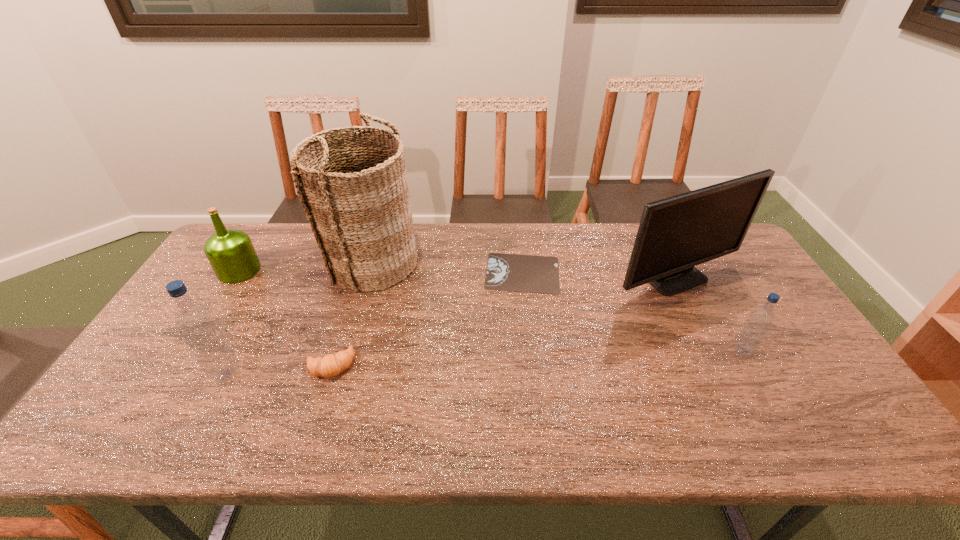
Where is `vacant area located on the front of the sixth object from right to left`? The height and width of the screenshot is (540, 960). vacant area located on the front of the sixth object from right to left is located at coordinates 210,405.

Find the location of a particular element. Image resolution: width=960 pixels, height=540 pixels. vacant area located on the left of the shorter water bottle is located at coordinates (581, 352).

In order to click on free space located on the front of the third object from right to left in this screenshot , I will do `click(530, 343)`.

This screenshot has width=960, height=540. Identify the location of free space located 0.090m on the left of the basket. (297, 261).

Identify the location of vacant region located 0.090m on the front-facing side of the computer monitor. The image size is (960, 540). pyautogui.click(x=702, y=327).

Identify the location of blank area located 0.060m on the front of the sixth tallest object. The image size is (960, 540). (319, 402).

Identify the location of free space located on the right of the leftmost object. (306, 271).

Where is `mousepad at the far edge`? The height and width of the screenshot is (540, 960). mousepad at the far edge is located at coordinates (505, 272).

Find the location of a particular element. This screenshot has width=960, height=540. basket at the far edge is located at coordinates (358, 204).

Find the location of a particular element. computer monitor at the far edge is located at coordinates tap(675, 234).